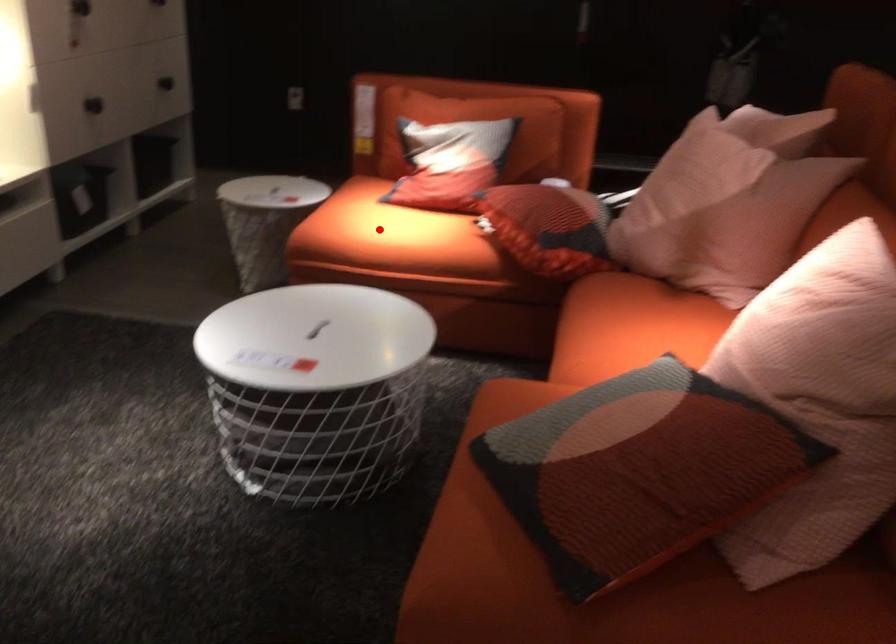
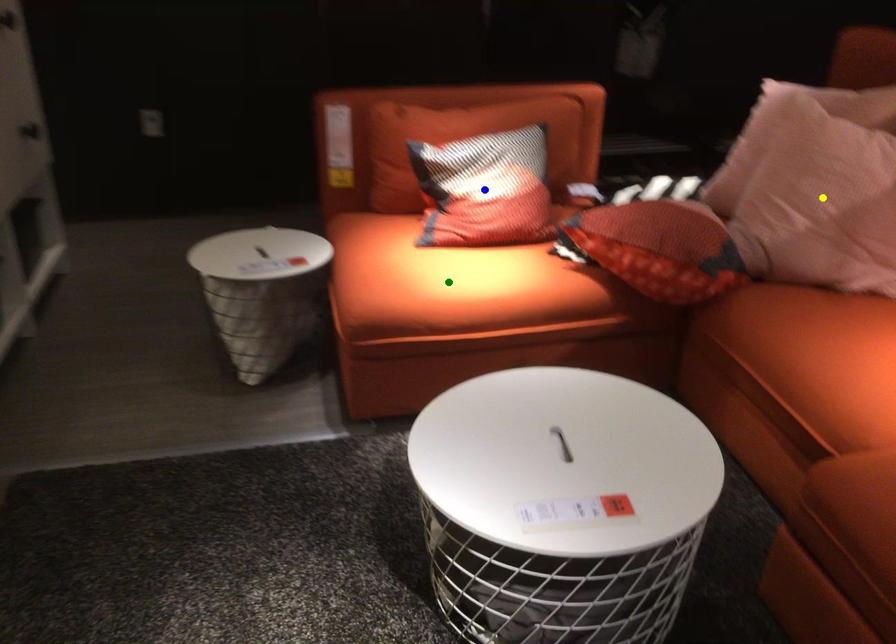
Question: I am providing you with two images of the same scene from different viewpoints. A red point is marked on the first image. You are given multiple points on the second image. Which spot in image 2 lines up with the point in image 1?

Choices:
 (A) blue point
 (B) green point
 (C) yellow point

Answer: (B)